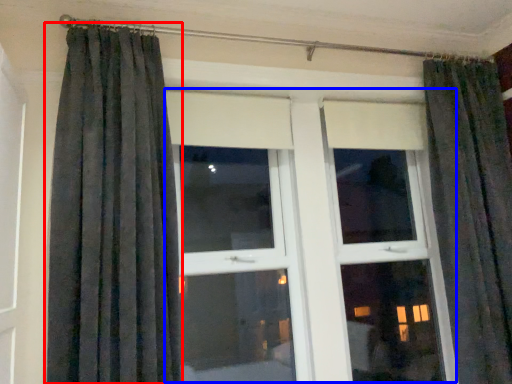
Question: Which of the following is the farthest to the observer, curtain (highlighted by a red box) or bay window (highlighted by a blue box)?

Choices:
 (A) curtain
 (B) bay window

Answer: (B)